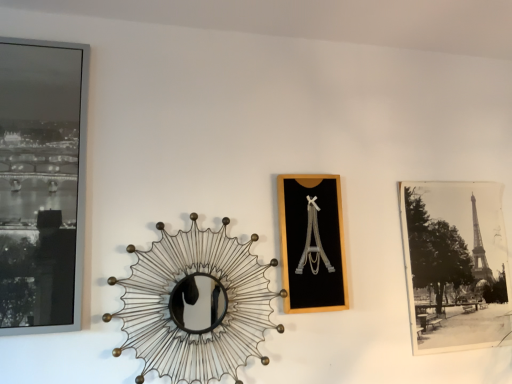
Question: From the image's perspective, relative to metallic wire sunburst mirror at center, is black paper photo at right, which is the 1th picture frame in back-to-front order, above or below?

Choices:
 (A) above
 (B) below

Answer: (A)

Question: Considering the relative positions of black paper photo at right, which ranks as the 1th picture frame in right-to-left order, and metallic wire sunburst mirror at center in the image provided, is black paper photo at right, which ranks as the 1th picture frame in right-to-left order, to the left or to the right of metallic wire sunburst mirror at center?

Choices:
 (A) left
 (B) right

Answer: (B)

Question: Considering the real-world distances, which object is farthest from the black matte picture frame at center, which appears as the 2th picture frame when viewed from the front?

Choices:
 (A) matte black frame at left, acting as the 3th picture frame starting from the right
 (B) metallic wire sunburst mirror at center
 (C) black paper photo at right, which is the 3th picture frame from front to back

Answer: (A)

Question: Which of these objects is positioned farthest from the metallic wire sunburst mirror at center?

Choices:
 (A) black paper photo at right, which is the 3th picture frame from front to back
 (B) matte black frame at left, acting as the 3th picture frame starting from the right
 (C) black matte picture frame at center, arranged as the 2th picture frame when viewed from the right

Answer: (A)